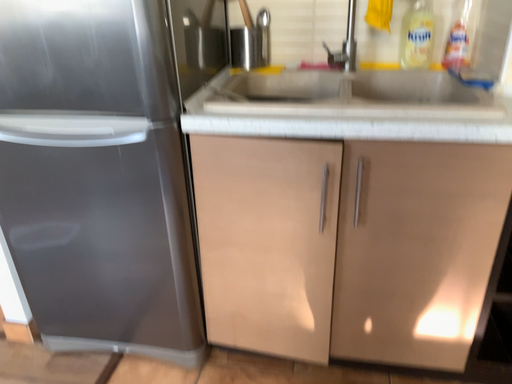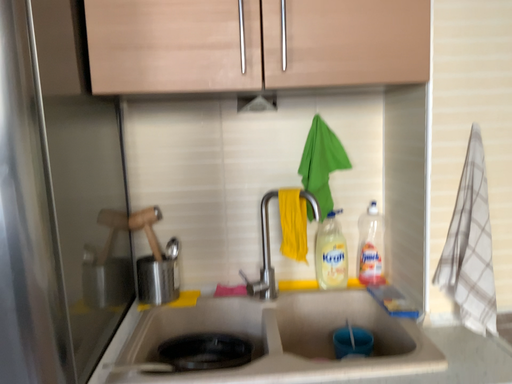
Question: How did the camera likely rotate when shooting the video?

Choices:
 (A) rotated downward
 (B) rotated upward

Answer: (B)